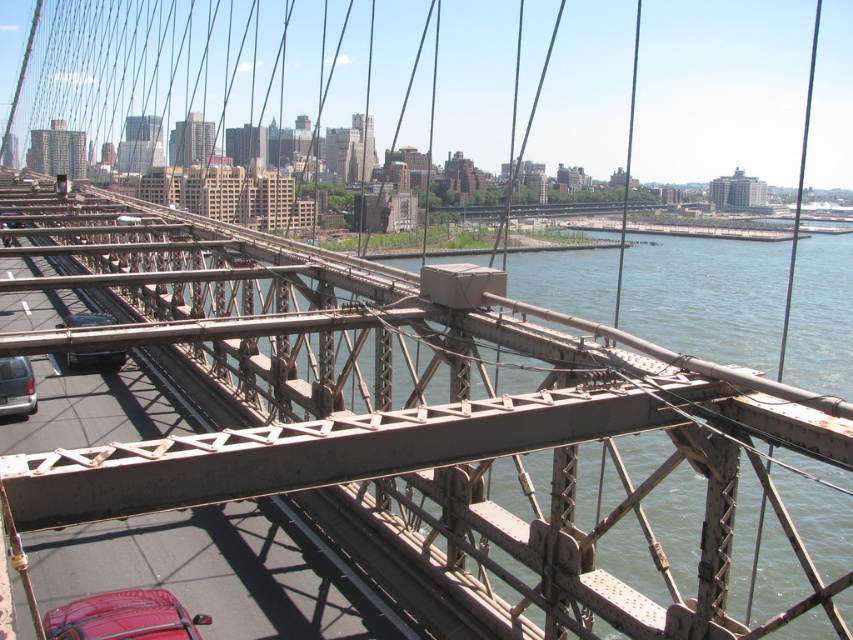
You are driving a 5.5 meter long truck and need to pass through the Brooklyn Bridge. You see the matte black van at left and the matte black car at lower left on the road. Is there enough space between them for your truck to safely pass through?

The distance between the matte black van at left and the matte black car at lower left is 6.75 meters. Since your truck is 5.5 meters long, there is sufficient space for it to pass through safely.

Consider the image. You are standing on the Brooklyn Bridge and want to take a photo of the two points marked in the image. Which point, point (x=51, y=614) or point (x=16, y=381), will appear larger in your photo?

Point (x=51, y=614) will appear larger in the photo because it is closer to the camera than point (x=16, y=381).